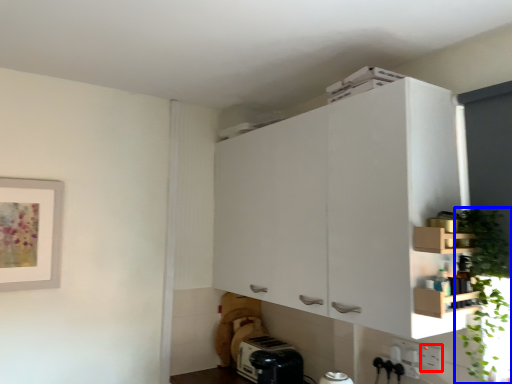
Question: Among these objects, which one is farthest to the camera, electric outlet (highlighted by a red box) or plant (highlighted by a blue box)?

Choices:
 (A) electric outlet
 (B) plant

Answer: (A)